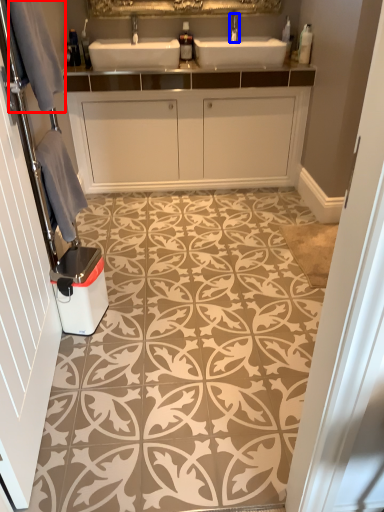
Question: Which object appears closest to the camera in this image, gray (highlighted by a red box) or tap (highlighted by a blue box)?

Choices:
 (A) gray
 (B) tap

Answer: (A)